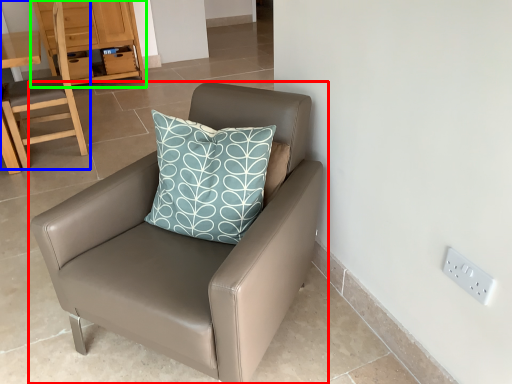
Question: Which is farther away from chair (highlighted by a red box)? chair (highlighted by a blue box) or dresser (highlighted by a green box)?

Choices:
 (A) chair
 (B) dresser

Answer: (B)